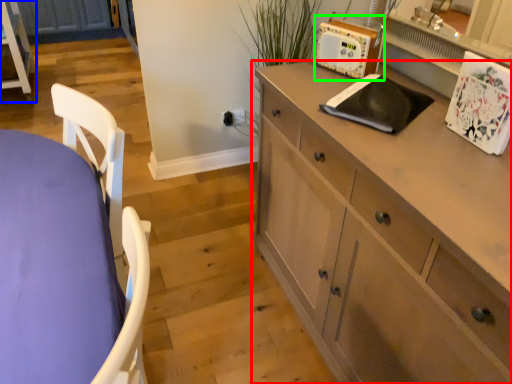
Question: Estimate the real-world distances between objects in this image. Which object is closer to cabinetry (highlighted by a red box), chest of drawers (highlighted by a blue box) or appliance (highlighted by a green box)?

Choices:
 (A) chest of drawers
 (B) appliance

Answer: (B)